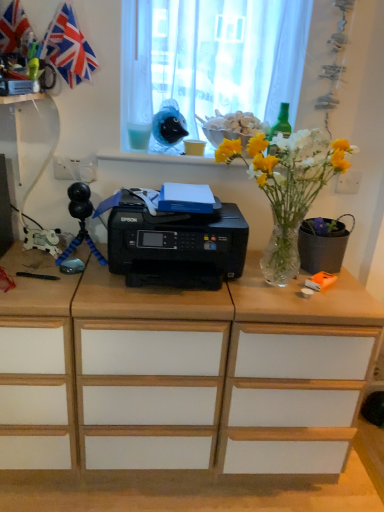
Question: From a real-world perspective, is red fabric flag at upper left on black matte flowerpot at right?

Choices:
 (A) yes
 (B) no

Answer: (A)

Question: Is red fabric flag at upper left thinner than black matte flowerpot at right?

Choices:
 (A) no
 (B) yes

Answer: (B)

Question: Are red fabric flag at upper left and black matte flowerpot at right beside each other?

Choices:
 (A) no
 (B) yes

Answer: (A)

Question: Is red fabric flag at upper left bigger than black matte flowerpot at right?

Choices:
 (A) no
 (B) yes

Answer: (B)

Question: Does red fabric flag at upper left appear on the right side of black matte flowerpot at right?

Choices:
 (A) yes
 (B) no

Answer: (B)

Question: From a real-world perspective, is green glass bottle at upper right, which ranks as the 1th stationery in right-to-left order, physically located above or below black plastic printer at center?

Choices:
 (A) below
 (B) above

Answer: (B)

Question: Relative to black plastic printer at center, is green glass bottle at upper right, the 2th stationery viewed from the left, in front or behind?

Choices:
 (A) front
 (B) behind

Answer: (B)

Question: Is green glass bottle at upper right, which ranks as the 1th stationery in right-to-left order, wider or thinner than black plastic printer at center?

Choices:
 (A) wide
 (B) thin

Answer: (B)

Question: Choose the correct answer: Is green glass bottle at upper right, which ranks as the 1th stationery in right-to-left order, inside black plastic printer at center or outside it?

Choices:
 (A) inside
 (B) outside

Answer: (B)

Question: Do you think clear glass vase at center is within white paper cup at upper center, placed as the 1th stationery when sorted from left to right, or outside of it?

Choices:
 (A) inside
 (B) outside

Answer: (B)

Question: From a real-world perspective, relative to white paper cup at upper center, placed as the 1th stationery when sorted from left to right, is clear glass vase at center vertically above or below?

Choices:
 (A) below
 (B) above

Answer: (A)

Question: Is clear glass vase at center wider or thinner than white paper cup at upper center, placed as the 1th stationery when sorted from left to right?

Choices:
 (A) thin
 (B) wide

Answer: (B)

Question: From the image's perspective, is clear glass vase at center positioned above or below white paper cup at upper center, the second stationery positioned from the right?

Choices:
 (A) below
 (B) above

Answer: (A)

Question: Is red fabric flag at upper left to the left or to the right of black matte flowerpot at right in the image?

Choices:
 (A) right
 (B) left

Answer: (B)

Question: Is red fabric flag at upper left spatially inside black matte flowerpot at right, or outside of it?

Choices:
 (A) outside
 (B) inside

Answer: (A)